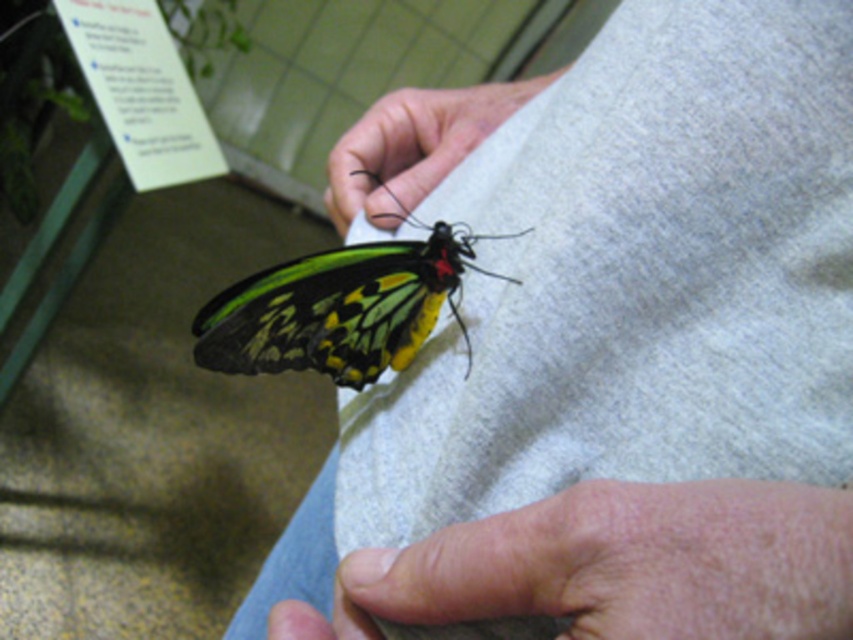
Is point (691, 550) positioned after point (358, 275)?

No, it is in front of (358, 275).

Can you confirm if dry skin at lower center is bigger than shiny metallic butterfly at center?

No, dry skin at lower center is not bigger than shiny metallic butterfly at center.

Describe the element at coordinates (614, 566) in the screenshot. I see `dry skin at lower center` at that location.

The image size is (853, 640). Identify the location of dry skin at lower center. (614, 566).

Can you confirm if dry skin at lower center is taller than matte black butterfly at center?

Incorrect, dry skin at lower center's height is not larger of matte black butterfly at center's.

From the picture: Does dry skin at lower center appear under matte black butterfly at center?

Yes, dry skin at lower center is below matte black butterfly at center.

The height and width of the screenshot is (640, 853). What do you see at coordinates (614, 566) in the screenshot? I see `dry skin at lower center` at bounding box center [614, 566].

This screenshot has height=640, width=853. I want to click on dry skin at lower center, so click(x=614, y=566).

The width and height of the screenshot is (853, 640). What are the coordinates of `shiny metallic butterfly at center` in the screenshot? It's located at (341, 307).

Which is in front, point (358, 332) or point (401, 131)?

Point (358, 332)

The height and width of the screenshot is (640, 853). Describe the element at coordinates (341, 307) in the screenshot. I see `shiny metallic butterfly at center` at that location.

This screenshot has height=640, width=853. What are the coordinates of `shiny metallic butterfly at center` in the screenshot? It's located at (341, 307).